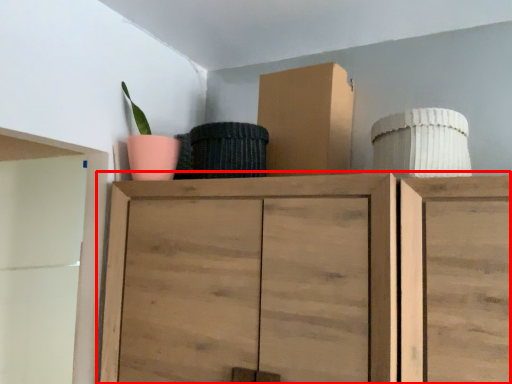
Question: From the image's perspective, where is cupboard (annotated by the red box) located relative to cardboard box?

Choices:
 (A) above
 (B) below

Answer: (B)